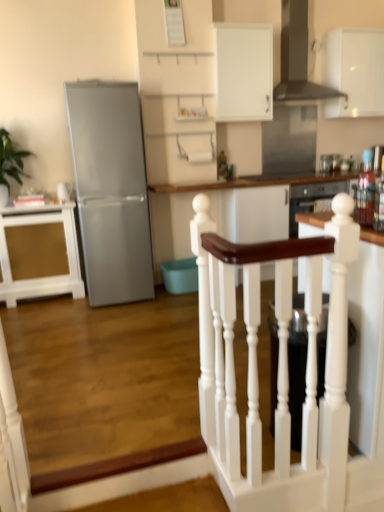
Question: Is white wood table at center wider than green leafy plant at left?

Choices:
 (A) yes
 (B) no

Answer: (A)

Question: Does white wood table at center lie in front of green leafy plant at left?

Choices:
 (A) no
 (B) yes

Answer: (A)

Question: Is white wood table at center bigger than green leafy plant at left?

Choices:
 (A) yes
 (B) no

Answer: (A)

Question: Is green leafy plant at left inside white wood table at center?

Choices:
 (A) yes
 (B) no

Answer: (B)

Question: Considering the relative sizes of white wood table at center and green leafy plant at left in the image provided, is white wood table at center taller than green leafy plant at left?

Choices:
 (A) yes
 (B) no

Answer: (A)

Question: From their relative heights in the image, would you say white wood table at center is taller or shorter than gold textured cabinet at left, which is the first cabinetry in bottom-to-top order?

Choices:
 (A) short
 (B) tall

Answer: (B)

Question: From a real-world perspective, is white wood table at center positioned above or below gold textured cabinet at left, the 1th cabinetry from the left?

Choices:
 (A) above
 (B) below

Answer: (A)

Question: Looking at their shapes, would you say white wood table at center is wider or thinner than gold textured cabinet at left, which is the first cabinetry in bottom-to-top order?

Choices:
 (A) thin
 (B) wide

Answer: (B)

Question: Is white wood table at center bigger or smaller than gold textured cabinet at left, which ranks as the 3th cabinetry in right-to-left order?

Choices:
 (A) small
 (B) big

Answer: (B)

Question: Would you say metallic stainless steel toaster at upper right, the 2th appliance in the left-to-right sequence, is inside or outside green leafy plant at left?

Choices:
 (A) outside
 (B) inside

Answer: (A)

Question: From the image's perspective, relative to green leafy plant at left, is metallic stainless steel toaster at upper right, the 2th appliance positioned from the bottom, above or below?

Choices:
 (A) above
 (B) below

Answer: (A)

Question: Looking at their shapes, would you say metallic stainless steel toaster at upper right, the first appliance from the back, is wider or thinner than green leafy plant at left?

Choices:
 (A) wide
 (B) thin

Answer: (B)

Question: In the image, is metallic stainless steel toaster at upper right, the 2th appliance positioned from the bottom, on the left side or the right side of green leafy plant at left?

Choices:
 (A) left
 (B) right

Answer: (B)

Question: Is satin silver refrigerator at left wider or thinner than green leafy plant at left?

Choices:
 (A) wide
 (B) thin

Answer: (A)

Question: From the image's perspective, relative to green leafy plant at left, is satin silver refrigerator at left above or below?

Choices:
 (A) below
 (B) above

Answer: (A)